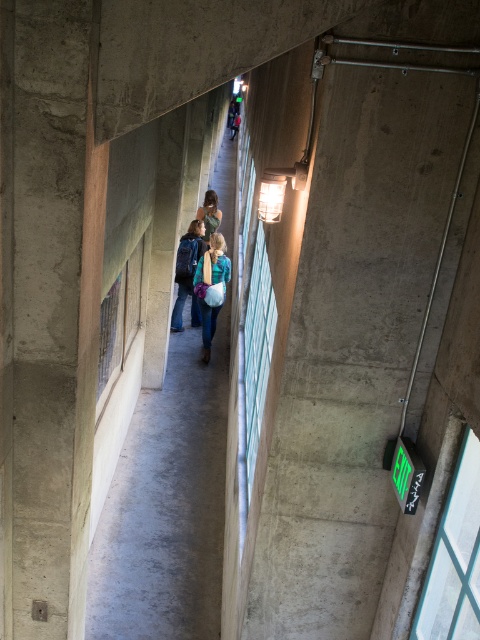
You are a delivery person carrying a package that is 6 feet long. You need to walk through the corridor shown in the image. Can you pass between the concrete wall at center and the matte blue backpack at center without tilting the package?

The concrete wall at center and the matte blue backpack at center are 6.05 feet apart, so the 6 feet long package can pass through the space between them without tilting since the distance is slightly more than the package length.

You are a painter who needs to cover the concrete wall at center and the matte blue backpack at center with paint. Which object requires more paint due to its size?

The concrete wall at center requires more paint because it is larger in size than the matte blue backpack at center.

You are trying to hang a picture frame that is 1 meter wide on the concrete wall at center. Considering the matte black jacket at center is currently in front of the wall, can you fit the frame on the wall without moving the jacket?

The concrete wall at center might be wider than matte black jacket at center, so there is a possibility that the frame can be placed on the wall without moving the jacket, but it depends on the actual width of the wall compared to the jacket.